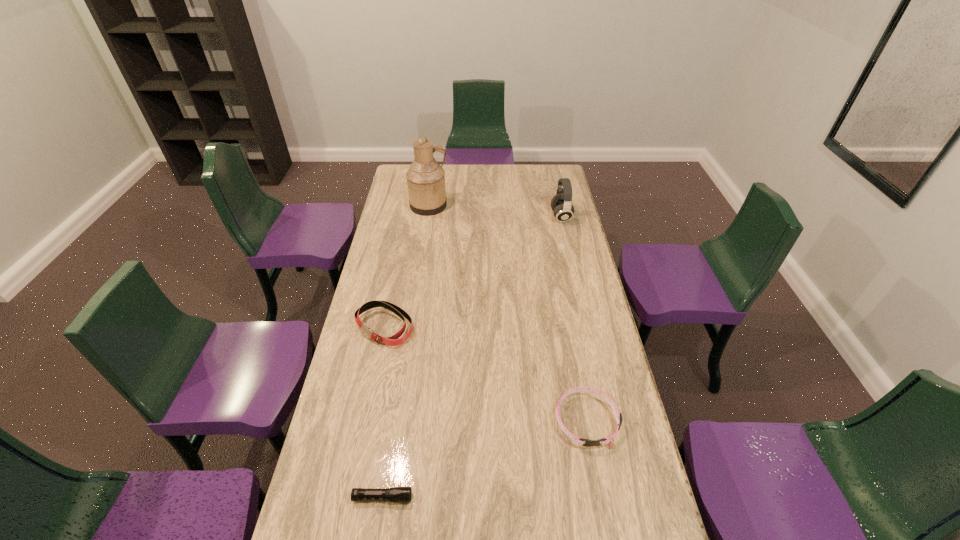
Locate an element on the screen. Image resolution: width=960 pixels, height=540 pixels. vacant space at the left edge of the desktop is located at coordinates (393, 293).

Where is `free point at the right edge`? This screenshot has height=540, width=960. free point at the right edge is located at coordinates (606, 531).

This screenshot has width=960, height=540. What are the coordinates of `free region at the far right corner of the desktop` in the screenshot? It's located at (556, 186).

This screenshot has width=960, height=540. In order to click on free area in between the flashlight and the nearer dog collar in this screenshot , I will do `click(485, 459)`.

You are a GUI agent. You are given a task and a screenshot of the screen. Output one action in this format:
    pyautogui.click(x=<x>, y=<y>)
    Task: Click on the free space between the second tallest object and the shortest object
    
    Given the screenshot: What is the action you would take?
    pyautogui.click(x=471, y=357)

Image resolution: width=960 pixels, height=540 pixels. What are the coordinates of `free spot between the third farthest object and the headset` in the screenshot? It's located at (472, 272).

Locate an element on the screen. The image size is (960, 540). vacant area that lies between the third farthest object and the nearest object is located at coordinates (383, 412).

Where is `vacant space that's between the second shortest object and the shortest object`? Image resolution: width=960 pixels, height=540 pixels. vacant space that's between the second shortest object and the shortest object is located at coordinates (485, 459).

Locate an element on the screen. This screenshot has height=540, width=960. free spot between the fourth shortest object and the pitcher is located at coordinates (495, 211).

Locate an element on the screen. The height and width of the screenshot is (540, 960). blank region between the flashlight and the right dog collar is located at coordinates [x=485, y=459].